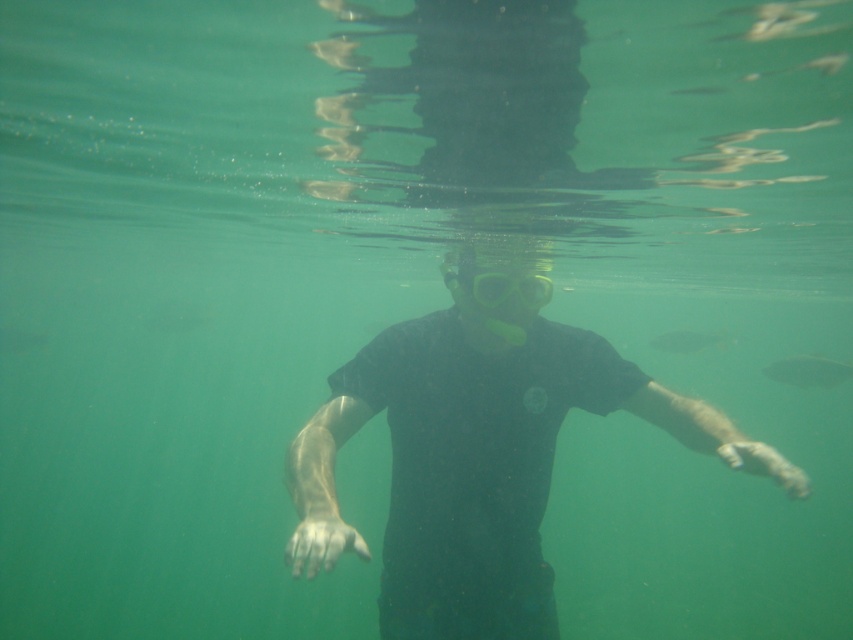
Question: Estimate the real-world distances between objects in this image. Which object is closer to the clear plastic goggles at center?

Choices:
 (A) translucent greenish fish at center
 (B) green matte fish at center

Answer: (A)

Question: Which point is farther to the camera?

Choices:
 (A) (834, 362)
 (B) (688, 333)
 (C) (552, 346)
 (D) (498, 276)

Answer: (B)

Question: Is clear plastic goggles at center behind green matte fish at center?

Choices:
 (A) no
 (B) yes

Answer: (A)

Question: From the image, what is the correct spatial relationship of black matte t-shirt at center in relation to green matte fish at center?

Choices:
 (A) below
 (B) above

Answer: (A)

Question: Does clear plastic goggles at center have a greater width compared to translucent greenish fish at center?

Choices:
 (A) no
 (B) yes

Answer: (A)

Question: Which point appears farthest from the camera in this image?

Choices:
 (A) (659, 340)
 (B) (473, 291)
 (C) (805, 387)
 (D) (410, 604)

Answer: (A)